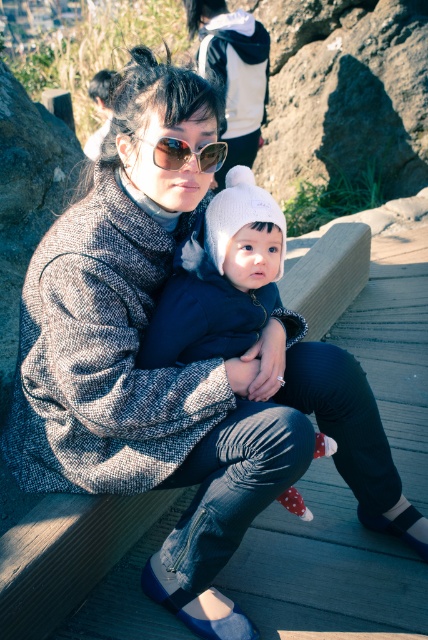
Question: Does white knit hat at center appear on the left side of sunglasses at center?

Choices:
 (A) yes
 (B) no

Answer: (B)

Question: Among these points, which one is nearest to the camera?

Choices:
 (A) (255, 244)
 (B) (184, 160)

Answer: (B)

Question: Which object is farther from the camera taking this photo?

Choices:
 (A) sunglasses at center
 (B) white knit hat at center

Answer: (B)

Question: Which point is closer to the camera?

Choices:
 (A) (148, 141)
 (B) (235, 205)

Answer: (A)

Question: Is white knit hat at center smaller than sunglasses at center?

Choices:
 (A) no
 (B) yes

Answer: (A)

Question: Where is white knit hat at center located in relation to sunglasses at center in the image?

Choices:
 (A) above
 (B) below

Answer: (B)